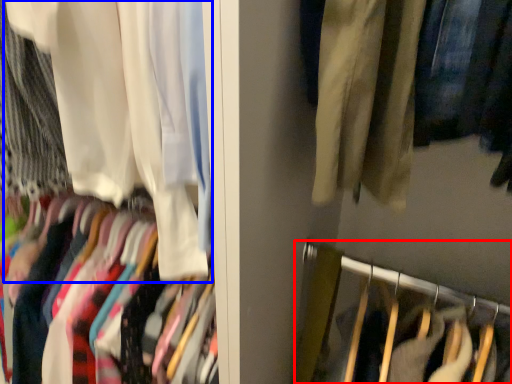
Question: Which object is further to the camera taking this photo, closet (highlighted by a red box) or curtain (highlighted by a blue box)?

Choices:
 (A) closet
 (B) curtain

Answer: (A)